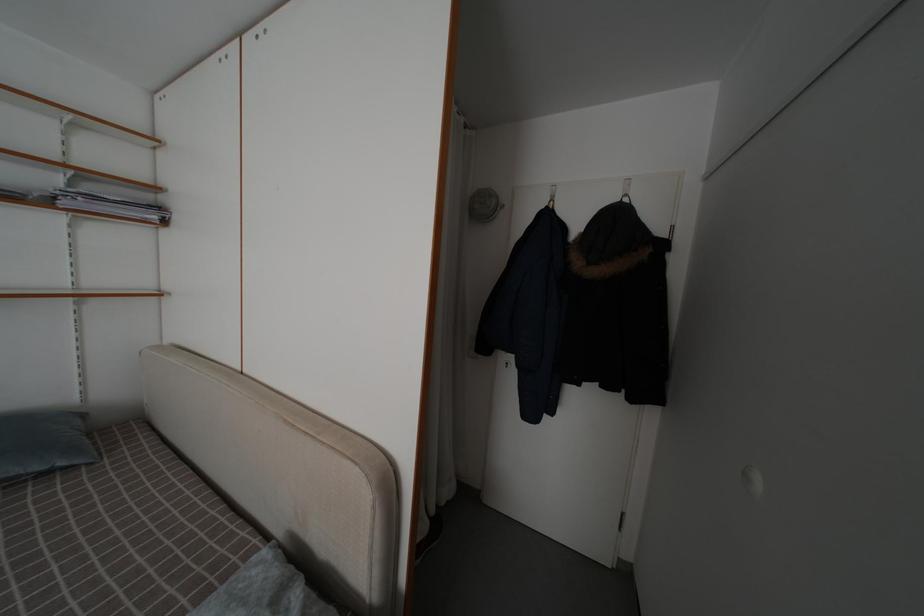
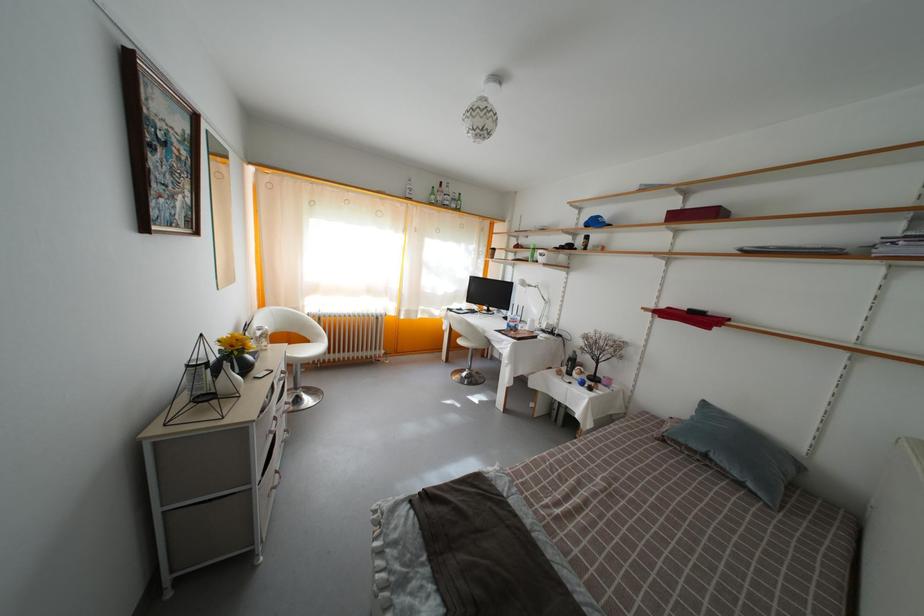
Where in the second image is the point corresponding to pixel 43 475 from the first image?

(743, 482)